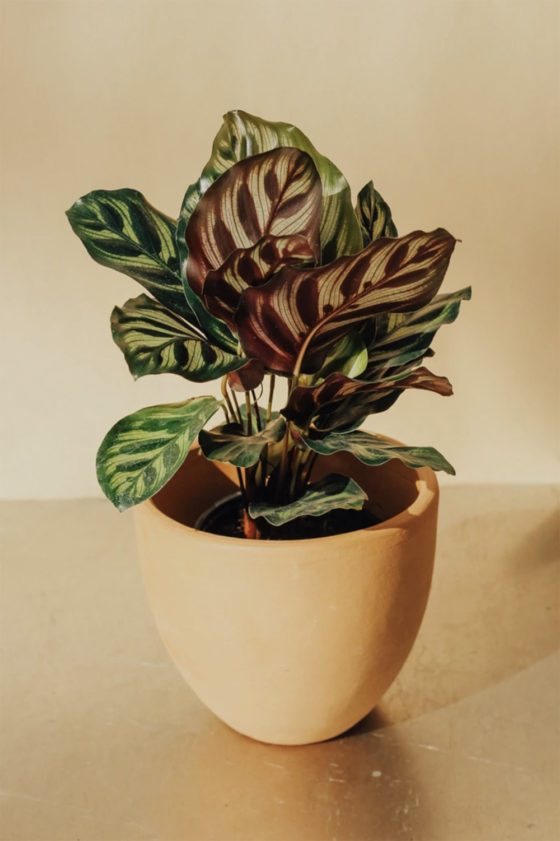
Identify the location of alive plant. (149, 452).